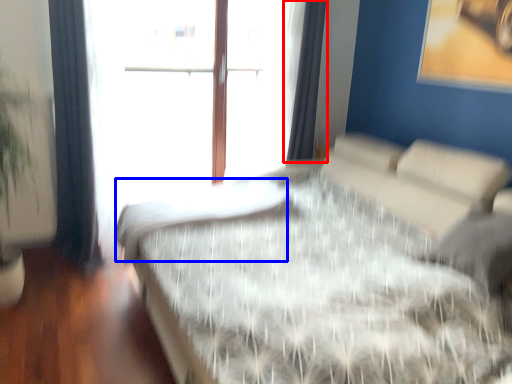
Question: Which of the following is the closest to the observer, curtain (highlighted by a red box) or mattress (highlighted by a blue box)?

Choices:
 (A) curtain
 (B) mattress

Answer: (B)